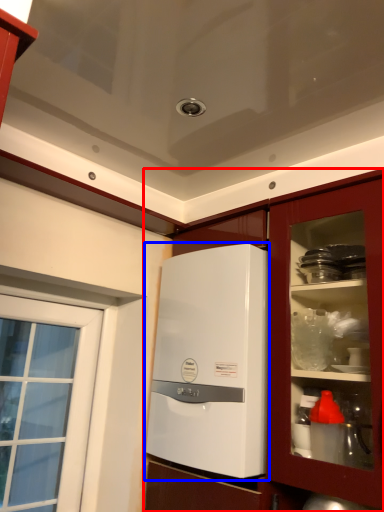
Question: Which object appears closest to the camera in this image, cabinetry (highlighted by a red box) or home appliance (highlighted by a blue box)?

Choices:
 (A) cabinetry
 (B) home appliance

Answer: (A)